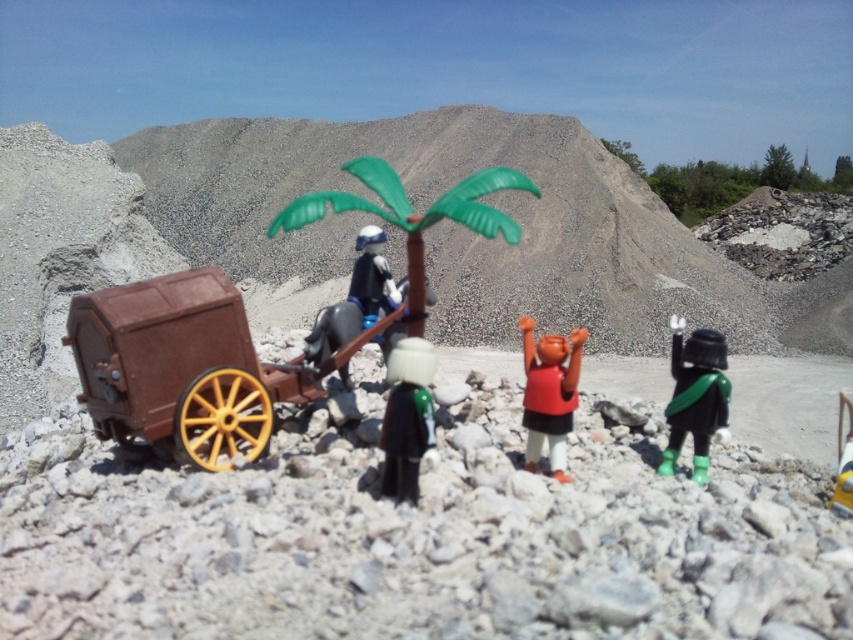
Is matte red tank top at center below yellow plastic toy at lower right?

Incorrect, matte red tank top at center is not positioned below yellow plastic toy at lower right.

Between matte red tank top at center and yellow plastic toy at lower right, which one is positioned higher?

matte red tank top at center is above.

Who is more forward, (560, 400) or (848, 454)?

Point (560, 400) is more forward.

Find the location of a particular element. The height and width of the screenshot is (640, 853). matte red tank top at center is located at coordinates (549, 394).

Does shiny black helmet at center right appear under shiny silver helmet at center?

Incorrect, shiny black helmet at center right is not positioned below shiny silver helmet at center.

Is shiny black helmet at center right to the right of shiny silver helmet at center from the viewer's perspective?

Correct, you'll find shiny black helmet at center right to the right of shiny silver helmet at center.

Is point (712, 353) positioned in front of point (415, 380)?

No, (712, 353) is behind (415, 380).

Identify the location of shiny black helmet at center right. The image size is (853, 640). (695, 396).

Is green plastic palm tree at center bigger than shiny black helmet at center right?

Yes.

Measure the distance between green plastic palm tree at center and camera.

green plastic palm tree at center is 6.89 feet away from camera.

Image resolution: width=853 pixels, height=640 pixels. I want to click on green plastic palm tree at center, so click(x=413, y=214).